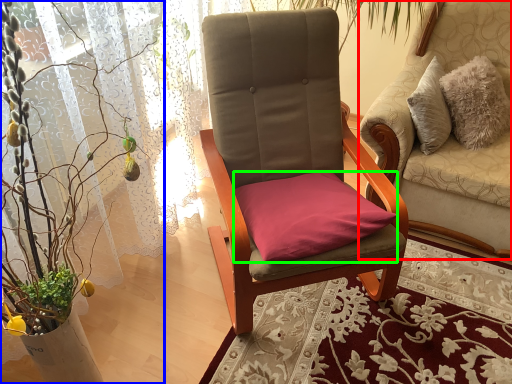
Question: Considering the real-world distances, which object is closest to chair (highlighted by a red box)? houseplant (highlighted by a blue box) or pillow (highlighted by a green box).

Choices:
 (A) houseplant
 (B) pillow

Answer: (B)